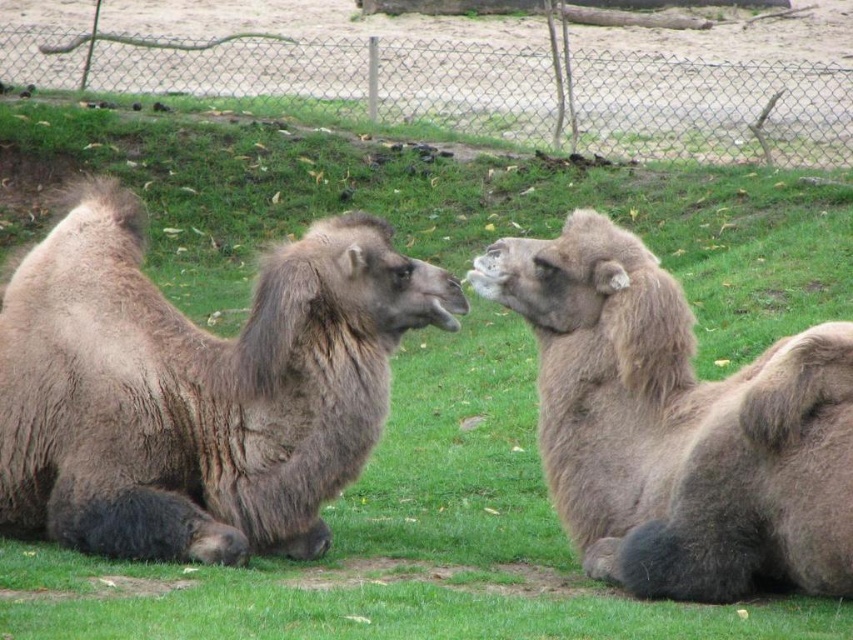
You are a zookeeper trying to measure the space between the fuzzy brown camel at center and the wire mesh fence at upper center. Which object is narrower in width?

The fuzzy brown camel at center has a lesser width compared to wire mesh fence at upper center, so the camel is narrower in width.

You are a zookeeper trying to determine if there is enough space between the brown fuzzy camel at left and the wire mesh fence at upper center to place a feeding trough. Based on their sizes, can you fit the trough between them?

The brown fuzzy camel at left occupies less space than the wire mesh fence at upper center, so there might be sufficient space between them to place the feeding trough, but the exact distance isn

You are standing at the point marked as point (96,515) in the zoo enclosure. You want to walk to the fence that separates the grassy area from the sandy area. Is the fence located behind you or in front of you?

The fence is located behind you because you are 6.43 meters away from the viewer, meaning you are facing away from the fence towards the camels.